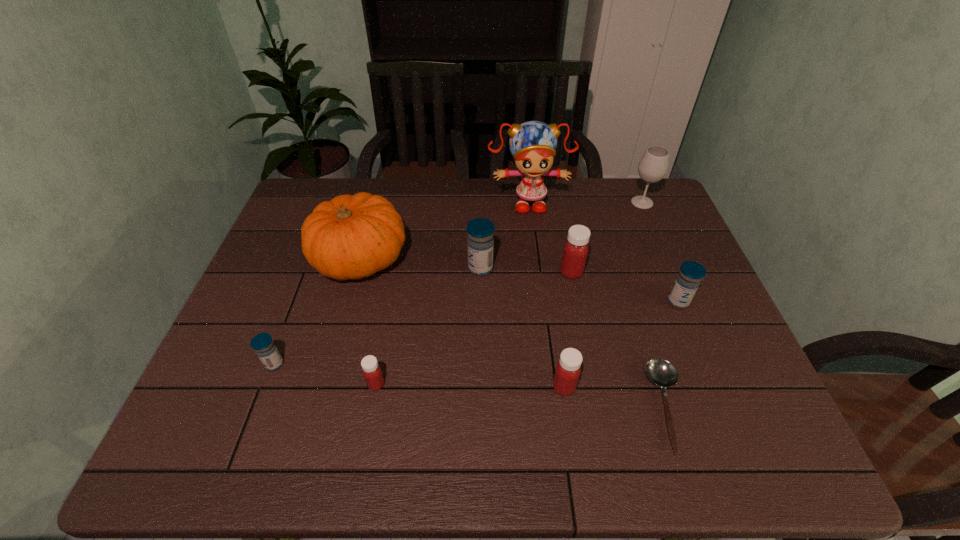
The image size is (960, 540). I want to click on pumpkin at the left edge, so click(350, 237).

The height and width of the screenshot is (540, 960). I want to click on medicine at the left edge, so click(x=263, y=345).

Find the location of `wineglass at the right edge`. wineglass at the right edge is located at coordinates (653, 166).

The image size is (960, 540). Identify the location of medicine positioned at the right edge. (691, 273).

The image size is (960, 540). What are the coordinates of `object at the far right corner` in the screenshot? It's located at (653, 166).

Image resolution: width=960 pixels, height=540 pixels. In order to click on free space at the far edge of the desktop in this screenshot , I will do `click(514, 193)`.

Locate an element on the screen. vacant space at the near edge of the desktop is located at coordinates (472, 439).

Where is `vacant space at the left edge of the desktop`? vacant space at the left edge of the desktop is located at coordinates (228, 346).

Locate an element on the screen. The image size is (960, 540). vacant space at the right edge of the desktop is located at coordinates (628, 228).

The height and width of the screenshot is (540, 960). In the image, there is a desktop. What are the coordinates of `vacant space at the near left corner` in the screenshot? It's located at pyautogui.click(x=210, y=462).